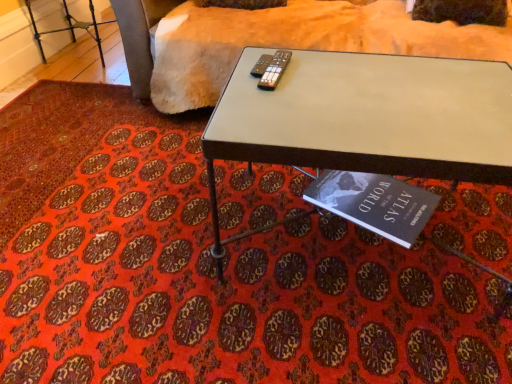
At what (x,y) coordinates should I click in order to perform the action: click on soft beige fabric at upper center. Please return your answer as a coordinate pair (x, y). Image resolution: width=512 pixels, height=384 pixels. Looking at the image, I should click on (281, 42).

In order to click on metallic silver remote at center in this screenshot , I will do `click(274, 70)`.

Where is `hardcover book at lower center`? hardcover book at lower center is located at coordinates (375, 203).

Is soft beige fabric at upper center positioned beyond the bounds of hardcover book at lower center?

Indeed, soft beige fabric at upper center is completely outside hardcover book at lower center.

From the image's perspective, between soft beige fabric at upper center and hardcover book at lower center, which one is located above?

soft beige fabric at upper center appears higher in the image.

Based on the photo, which of these two, soft beige fabric at upper center or hardcover book at lower center, is wider?

soft beige fabric at upper center is wider.

Can you confirm if hardcover book at lower center is shorter than metallic silver remote at center?

No.

From the image's perspective, is hardcover book at lower center positioned above or below metallic silver remote at center?

From the image's perspective, hardcover book at lower center appears below metallic silver remote at center.

From a real-world perspective, is hardcover book at lower center located beneath metallic silver remote at center?

Correct, in the physical world, hardcover book at lower center is lower than metallic silver remote at center.

Would you say hardcover book at lower center is inside or outside metallic silver remote at center?

hardcover book at lower center is not inside metallic silver remote at center, it's outside.

Looking at this image, based on their positions, is soft beige fabric at upper center located to the left or right of metallic gray table at center?

From the image, it's evident that soft beige fabric at upper center is to the right of metallic gray table at center.

Considering the relative sizes of soft beige fabric at upper center and metallic gray table at center in the image provided, is soft beige fabric at upper center smaller than metallic gray table at center?

No.

From the image's perspective, relative to metallic gray table at center, is soft beige fabric at upper center above or below?

From the image's perspective, soft beige fabric at upper center appears above metallic gray table at center.

Is soft beige fabric at upper center placed right next to metallic gray table at center?

soft beige fabric at upper center is not next to metallic gray table at center, and they're not touching.

Is metallic silver remote at center further to camera compared to hardcover book at lower center?

No, metallic silver remote at center is closer to the viewer.

This screenshot has height=384, width=512. In order to click on book behind the metallic silver remote at center in this screenshot , I will do `click(375, 203)`.

Between metallic silver remote at center and hardcover book at lower center, which one appears on the right side from the viewer's perspective?

hardcover book at lower center is more to the right.

Considering the sizes of objects metallic silver remote at center and hardcover book at lower center in the image provided, who is thinner, metallic silver remote at center or hardcover book at lower center?

metallic silver remote at center.

How much distance is there between soft beige fabric at upper center and metallic silver remote at center?

27.52 inches.

Is soft beige fabric at upper center oriented away from metallic silver remote at center?

soft beige fabric at upper center is not turned away from metallic silver remote at center.

Are soft beige fabric at upper center and metallic silver remote at center far apart?

No, there isn't a large distance between soft beige fabric at upper center and metallic silver remote at center.

Which is in front, point (424, 22) or point (265, 71)?

The point (265, 71) is more forward.

Is metallic gray table at center to the left or to the right of hardcover book at lower center in the image?

metallic gray table at center is positioned on hardcover book at lower center's left side.

Considering the relative sizes of metallic gray table at center and hardcover book at lower center in the image provided, is metallic gray table at center bigger than hardcover book at lower center?

Indeed, metallic gray table at center has a larger size compared to hardcover book at lower center.

In the image, is metallic gray table at center positioned in front of or behind hardcover book at lower center?

metallic gray table at center is positioned closer to the viewer than hardcover book at lower center.

From a real-world perspective, is metallic gray table at center physically above hardcover book at lower center?

Yes, from a real-world perspective, metallic gray table at center is over hardcover book at lower center

The width and height of the screenshot is (512, 384). Identify the location of remote behind the metallic gray table at center. (274, 70).

How much distance is there between metallic silver remote at center and metallic gray table at center?

metallic silver remote at center and metallic gray table at center are 11.11 inches apart from each other.

Which is more to the right, metallic silver remote at center or metallic gray table at center?

metallic gray table at center is more to the right.

Is metallic silver remote at center in front of metallic gray table at center?

No, metallic silver remote at center is further to the viewer.

I want to click on bedding behind the hardcover book at lower center, so click(x=281, y=42).

In the image, there is a hardcover book at lower center. Where is `remote above it (from the image's perspective)`? remote above it (from the image's perspective) is located at coordinates (274, 70).

Considering their positions, is soft beige fabric at upper center positioned closer to metallic silver remote at center than metallic gray table at center?

metallic gray table at center lies closer to metallic silver remote at center than the other object.

Considering their positions, is metallic silver remote at center positioned closer to metallic gray table at center than soft beige fabric at upper center?

metallic silver remote at center is positioned closer to the anchor metallic gray table at center.

Based on their spatial positions, is soft beige fabric at upper center or hardcover book at lower center closer to metallic silver remote at center?

Based on the image, hardcover book at lower center appears to be nearer to metallic silver remote at center.

Based on their spatial positions, is metallic gray table at center or hardcover book at lower center closer to soft beige fabric at upper center?

The object closer to soft beige fabric at upper center is metallic gray table at center.

When comparing their distances from soft beige fabric at upper center, does metallic silver remote at center or hardcover book at lower center seem closer?

hardcover book at lower center is positioned closer to the anchor soft beige fabric at upper center.

Which object lies nearer to the anchor point hardcover book at lower center, metallic silver remote at center or soft beige fabric at upper center?

metallic silver remote at center is closer to hardcover book at lower center.

When comparing their distances from soft beige fabric at upper center, does metallic gray table at center or metallic silver remote at center seem closer?

metallic gray table at center lies closer to soft beige fabric at upper center than the other object.

Estimate the real-world distances between objects in this image. Which object is closer to metallic gray table at center, hardcover book at lower center or soft beige fabric at upper center?

hardcover book at lower center is closer to metallic gray table at center.

This screenshot has height=384, width=512. Identify the location of table between soft beige fabric at upper center and hardcover book at lower center in the up-down direction. (366, 119).

At what (x,y) coordinates should I click in order to perform the action: click on remote between soft beige fabric at upper center and metallic gray table at center in the up-down direction. Please return your answer as a coordinate pair (x, y). The height and width of the screenshot is (384, 512). Looking at the image, I should click on (274, 70).

Find the location of a particular element. The width and height of the screenshot is (512, 384). remote between soft beige fabric at upper center and hardcover book at lower center vertically is located at coordinates (274, 70).

Locate an element on the screen. The height and width of the screenshot is (384, 512). table between metallic silver remote at center and hardcover book at lower center vertically is located at coordinates (366, 119).